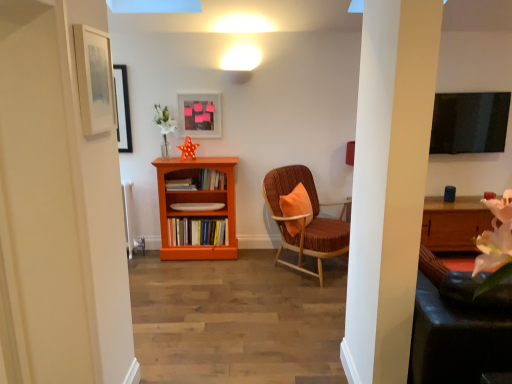
Where is `free location to the left of velvet brown chair with orange cushion at center`? free location to the left of velvet brown chair with orange cushion at center is located at coordinates (236, 281).